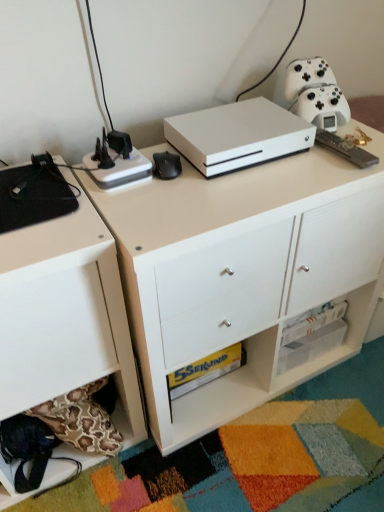
This screenshot has width=384, height=512. In order to click on free space above white matte chest of drawers at lower left (from a real-world perspective) in this screenshot , I will do `click(29, 207)`.